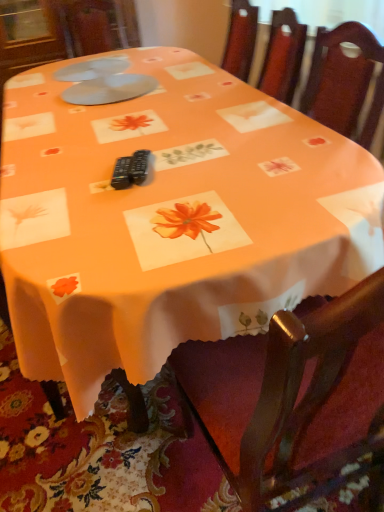
Where is `free point in front of matte plastic plates at upper center, the first tableware positioned from the front`? This screenshot has width=384, height=512. free point in front of matte plastic plates at upper center, the first tableware positioned from the front is located at coordinates (96, 124).